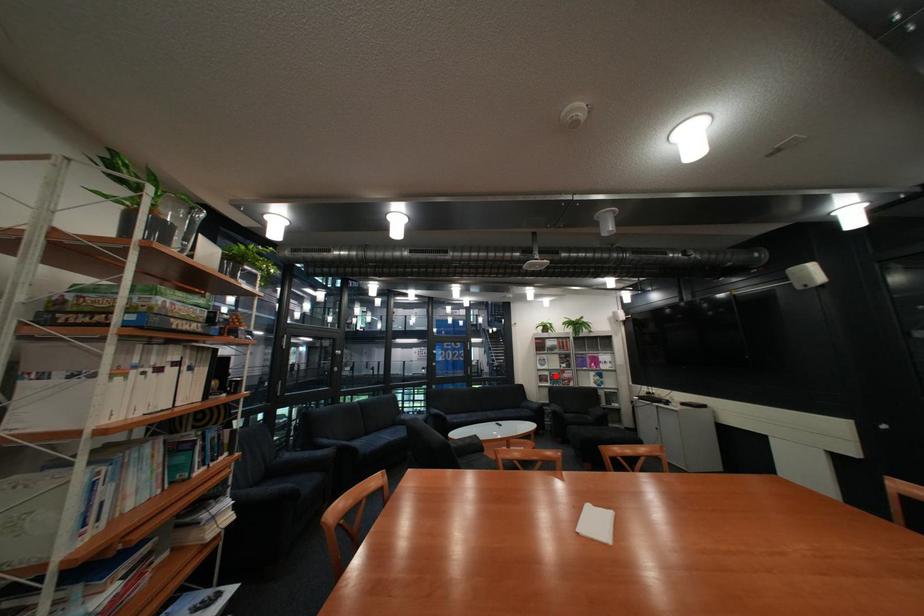
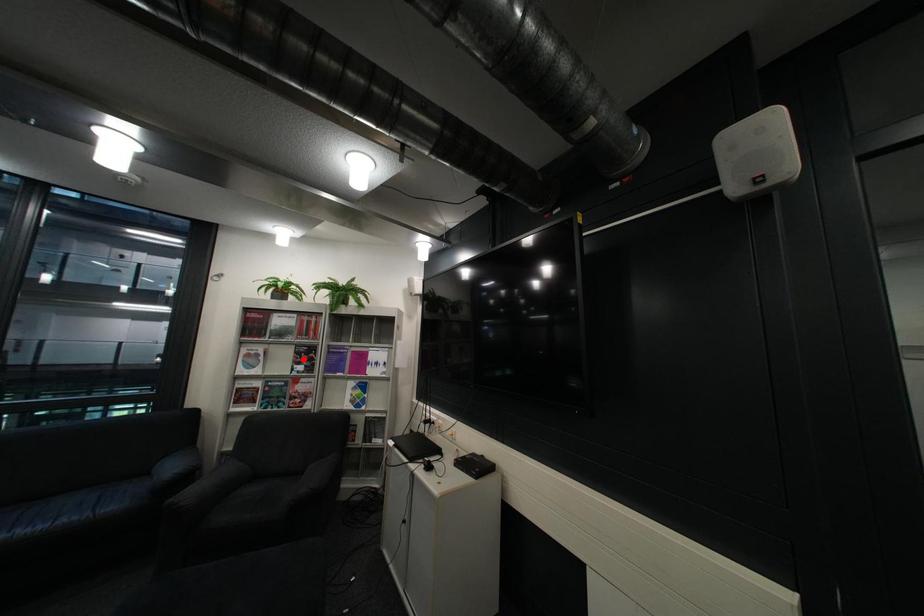
I am providing you with two images of the same scene from different viewpoints. A red point is marked on the first image and another point is marked on the second image. Do the highlighted points in image1 and image2 indicate the same real-world spot?

No